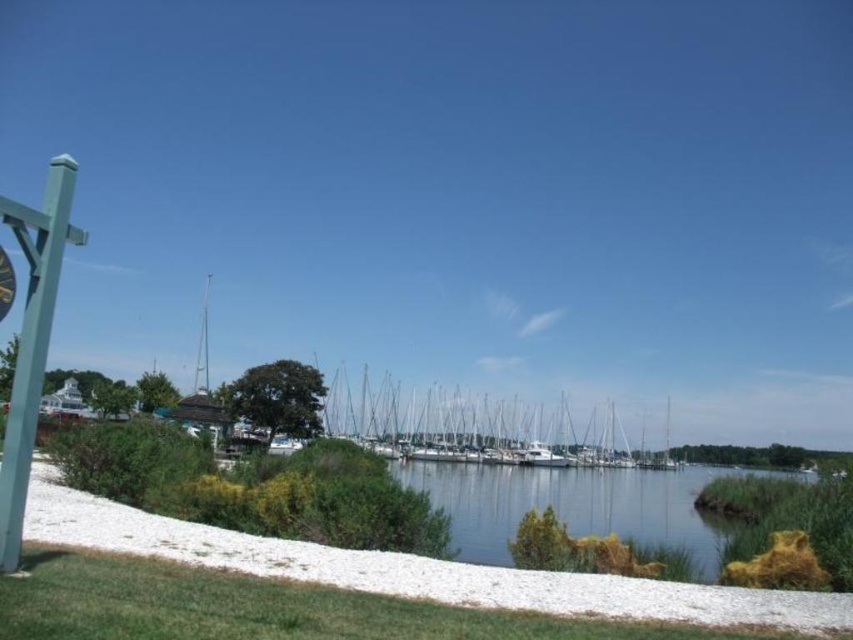
Which is below, white glossy boats at center or metallic gold clock at left?

white glossy boats at center is lower down.

Does white glossy boats at center come behind metallic gold clock at left?

Yes, it is behind metallic gold clock at left.

Does point (439, 458) come farther from viewer compared to point (4, 275)?

Yes, point (439, 458) is farther from viewer.

At what (x,y) coordinates should I click in order to perform the action: click on white glossy boats at center. Please return your answer as a coordinate pair (x, y). Image resolution: width=853 pixels, height=640 pixels. Looking at the image, I should click on (479, 428).

Which is more to the left, green painted wood post at left or metallic gold clock at left?

From the viewer's perspective, green painted wood post at left appears more on the left side.

From the picture: Does green painted wood post at left have a greater width compared to metallic gold clock at left?

Correct, the width of green painted wood post at left exceeds that of metallic gold clock at left.

Which is behind, point (32, 300) or point (3, 291)?

The point (32, 300) is behind.

This screenshot has height=640, width=853. Identify the location of green painted wood post at left. (32, 339).

Can you confirm if white glossy boats at center is smaller than green painted wood post at left?

No, white glossy boats at center is not smaller than green painted wood post at left.

Which is more to the right, white glossy boats at center or green painted wood post at left?

white glossy boats at center is more to the right.

I want to click on white glossy boats at center, so click(479, 428).

At what (x,y) coordinates should I click in order to perform the action: click on white glossy boats at center. Please return your answer as a coordinate pair (x, y). This screenshot has height=640, width=853. Looking at the image, I should click on (479, 428).